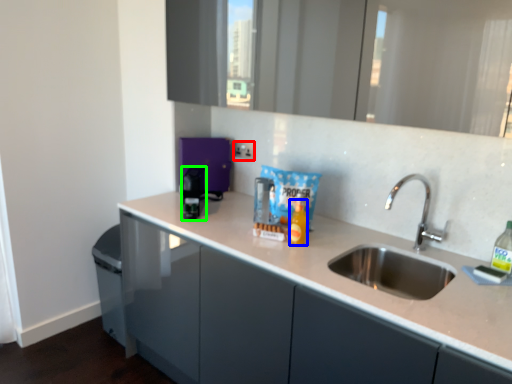
Question: Which is farther away from electric outlet (highlighted by a red box)? bottle (highlighted by a blue box) or appliance (highlighted by a green box)?

Choices:
 (A) bottle
 (B) appliance

Answer: (A)